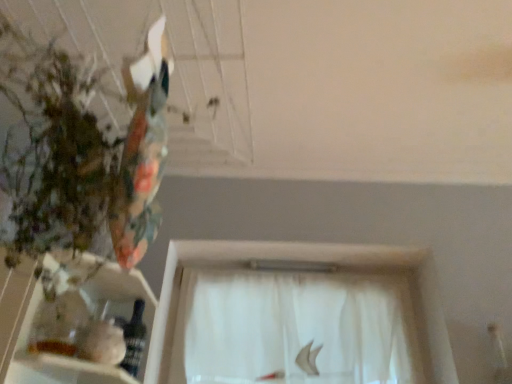
The width and height of the screenshot is (512, 384). Describe the element at coordinates (28, 339) in the screenshot. I see `wooden shelf at lower left` at that location.

At what (x,y) coordinates should I click in order to perform the action: click on wooden shelf at lower left. Please return your answer as a coordinate pair (x, y). Looking at the image, I should click on (28, 339).

You are a GUI agent. You are given a task and a screenshot of the screen. Output one action in this format:
    pyautogui.click(x=<x>, y=<y>)
    Task: Click on the wooden shelf at lower left
    
    Given the screenshot: What is the action you would take?
    pyautogui.click(x=28, y=339)